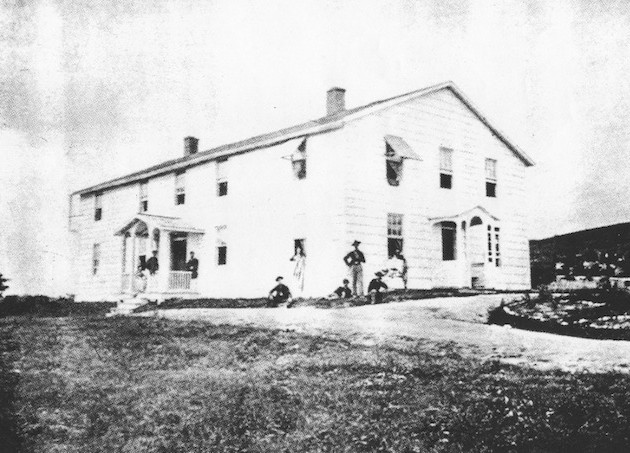
At what (x,y) coordinates should I click in order to perform the action: click on stairs. Please return your answer as a coordinate pair (x, y). This screenshot has height=453, width=630. Looking at the image, I should click on (128, 299).